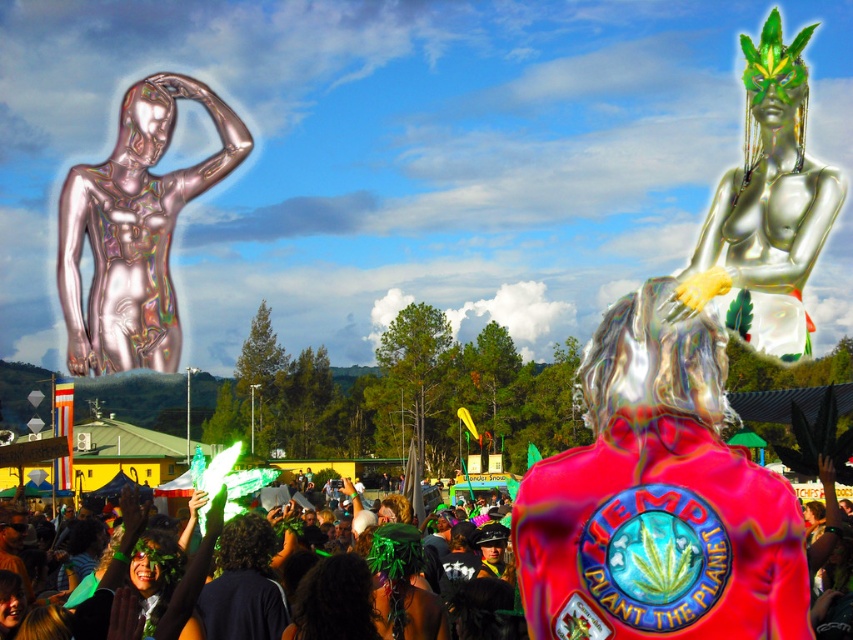
Question: Can you confirm if metallic silver jacket at center is thinner than silver metallic figure at upper right?

Choices:
 (A) yes
 (B) no

Answer: (A)

Question: Which object is the closest to the metallic silver jacket at center?

Choices:
 (A) silver metallic figure at upper right
 (B) holographic metallic statue at upper left
 (C) metallic green leaf at lower left

Answer: (C)

Question: Among these objects, which one is nearest to the camera?

Choices:
 (A) holographic metallic statue at upper left
 (B) metallic silver jacket at center
 (C) silver metallic figure at upper right

Answer: (B)

Question: Can you confirm if holographic metallic statue at upper left is positioned to the left of metallic green leaf at lower left?

Choices:
 (A) no
 (B) yes

Answer: (B)

Question: Which object is positioned closest to the silver metallic figure at upper right?

Choices:
 (A) metallic green leaf at lower left
 (B) holographic metallic statue at upper left

Answer: (A)

Question: Is metallic silver jacket at center above holographic metallic statue at upper left?

Choices:
 (A) no
 (B) yes

Answer: (A)